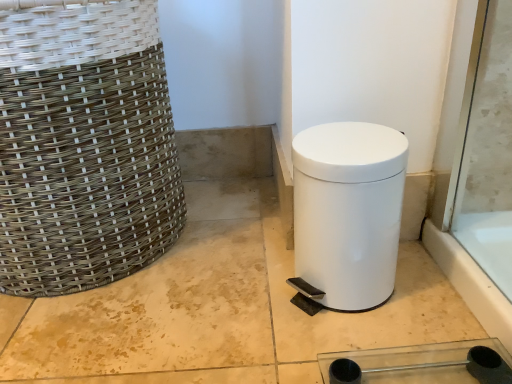
Locate an element on the screen. empty space that is ontop of white glossy trash can at lower right (from a real-world perspective) is located at coordinates (342, 142).